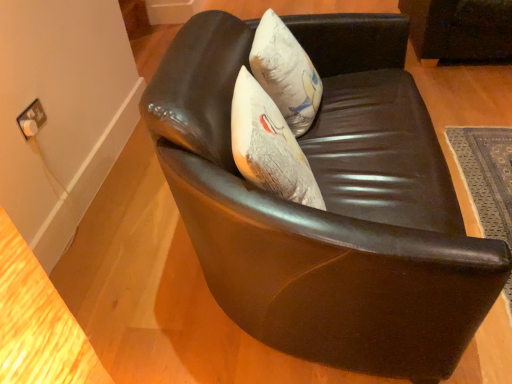
Question: Does shiny black leather chair at center have a larger size compared to white fabric pillow at center?

Choices:
 (A) no
 (B) yes

Answer: (B)

Question: Does shiny black leather chair at center turn towards white fabric pillow at center?

Choices:
 (A) no
 (B) yes

Answer: (B)

Question: Can you confirm if shiny black leather chair at center is shorter than white fabric pillow at center?

Choices:
 (A) yes
 (B) no

Answer: (B)

Question: From a real-world perspective, is shiny black leather chair at center located beneath white fabric pillow at center?

Choices:
 (A) no
 (B) yes

Answer: (B)

Question: Does shiny black leather chair at center have a greater width compared to white fabric pillow at center?

Choices:
 (A) yes
 (B) no

Answer: (A)

Question: From a real-world perspective, is shiny black leather chair at center on top of white fabric pillow at center?

Choices:
 (A) no
 (B) yes

Answer: (A)

Question: From a real-world perspective, is white fabric pillow at center positioned under shiny black leather chair at center based on gravity?

Choices:
 (A) no
 (B) yes

Answer: (A)

Question: Would you say white fabric pillow at center is a long distance from shiny black leather chair at center?

Choices:
 (A) yes
 (B) no

Answer: (B)

Question: Is white fabric pillow at center directly adjacent to shiny black leather chair at center?

Choices:
 (A) no
 (B) yes

Answer: (A)

Question: From the image's perspective, is white fabric pillow at center below shiny black leather chair at center?

Choices:
 (A) no
 (B) yes

Answer: (A)

Question: Does white fabric pillow at center turn towards shiny black leather chair at center?

Choices:
 (A) yes
 (B) no

Answer: (A)

Question: Does white fabric pillow at center lie in front of shiny black leather chair at center?

Choices:
 (A) yes
 (B) no

Answer: (B)

Question: Is white fabric pillow at center thinner than dark gray woven mat at lower right?

Choices:
 (A) yes
 (B) no

Answer: (A)